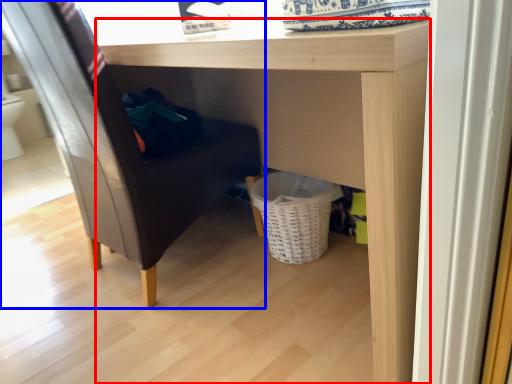
Question: Which object appears farthest to the camera in this image, table (highlighted by a red box) or furniture (highlighted by a blue box)?

Choices:
 (A) table
 (B) furniture

Answer: (B)